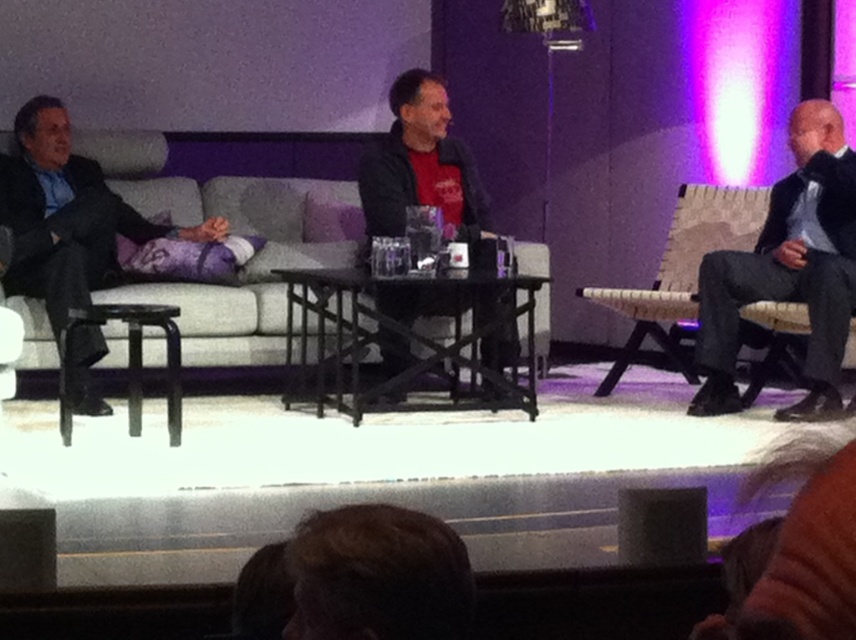
Question: Is dark gray suit at left behind woven fabric chair at right?

Choices:
 (A) no
 (B) yes

Answer: (A)

Question: Which object is the farthest from the dark gray suit at right?

Choices:
 (A) black matte jacket at center
 (B) dark gray suit at left
 (C) woven fabric chair at right

Answer: (B)

Question: Which point is farther to the camera?

Choices:
 (A) click(815, 124)
 (B) click(93, 200)
 (C) click(642, 324)
 (D) click(414, 198)

Answer: (C)

Question: Among these points, which one is farthest from the camera?

Choices:
 (A) (813, 243)
 (B) (604, 301)

Answer: (B)

Question: Observing the image, what is the correct spatial positioning of dark gray suit at left in reference to black matte jacket at center?

Choices:
 (A) right
 (B) left

Answer: (B)

Question: Can you confirm if dark gray suit at left is positioned to the right of woven fabric chair at right?

Choices:
 (A) no
 (B) yes

Answer: (A)